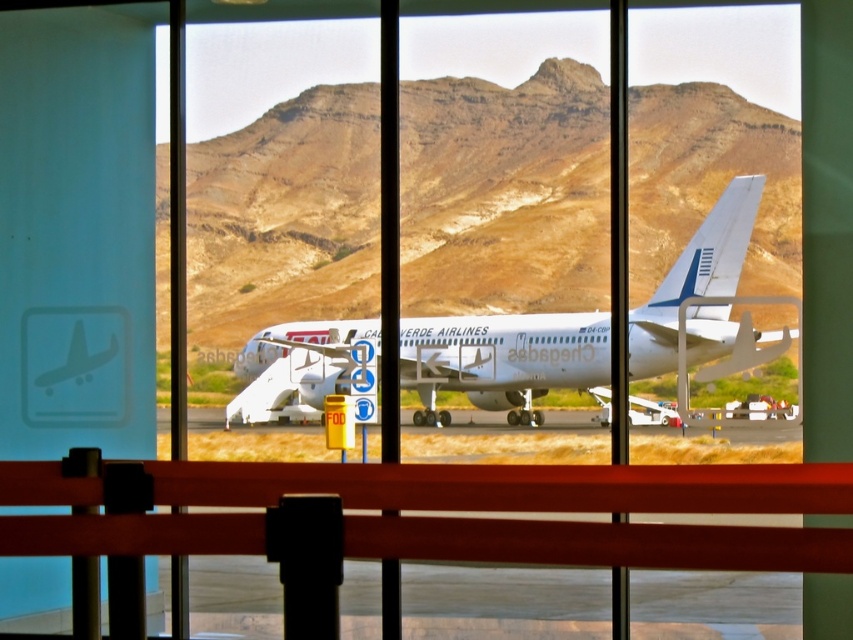
You are a pilot preparing for takeoff and notice the brown rocky mountain at center and the white glossy airplane at center through the airport terminal window. Based on their sizes in the view, which object appears wider?

The brown rocky mountain at center appears wider than the white glossy airplane at center because its width surpasses that of the airplane.

You are standing in the airport terminal looking through the window. You notice two points marked on the window. One is at coordinate point (206,237) and the other at point (215,529). Which point is closer to you?

Point (215,529) is closer to you because it is less further to the camera than point (206,237).